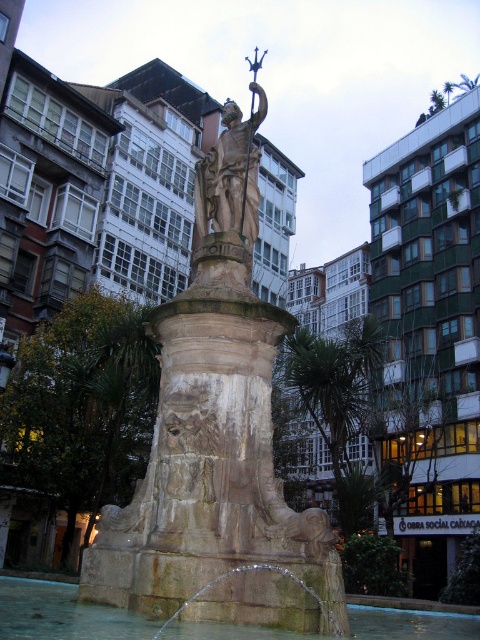
You are standing in the urban area and want to take a photo of the stone fountain at center and the clear water at fountain center. Which object should you focus on first if you want to capture both in one shot?

The stone fountain at center is further to the viewer than clear water at fountain center, so you should focus on the stone fountain at center first to ensure both are in focus.

You are standing at the origin point of the coordinate system in an urban area. You need to locate the stone fountain at center. What are the coordinates where you can find it?

The stone fountain at center can be found at coordinates point (217, 444).